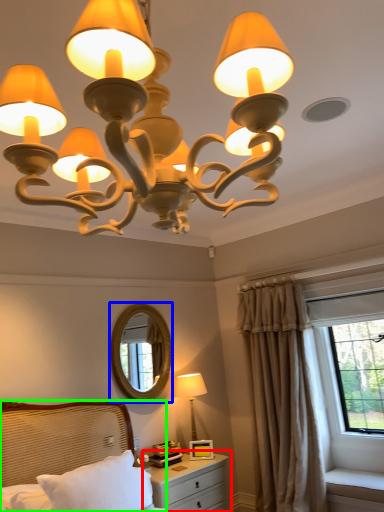
Question: Based on their relative distances, which object is farther from nightstand (highlighted by a red box)? Choose from mirror (highlighted by a blue box) and bed (highlighted by a green box).

Choices:
 (A) mirror
 (B) bed

Answer: (A)